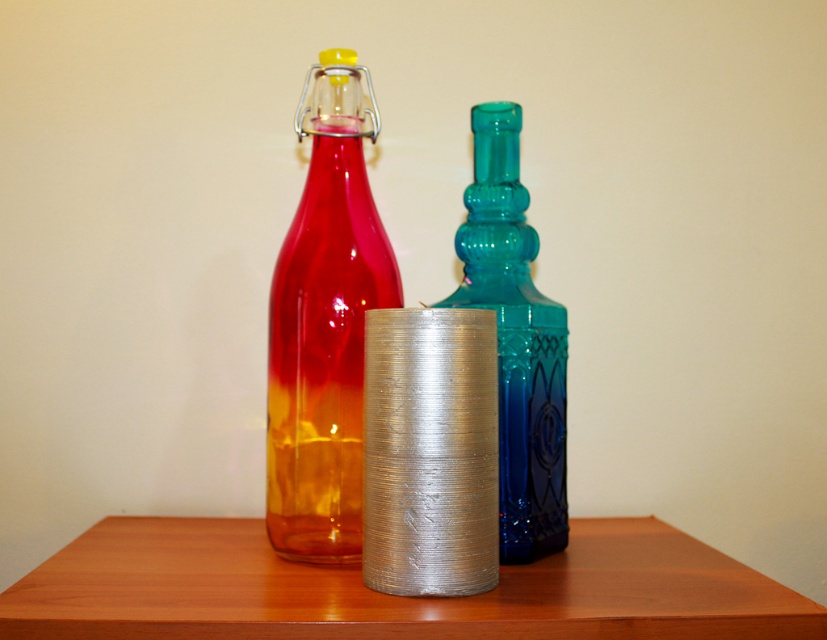
You are a delivery person who needs to place a package that is 6 inches long on the wooden table at center without touching the translucent blue glass bottle at center. Is there enough space?

The wooden table at center and translucent blue glass bottle at center are 5.82 inches apart from each other. Since the package is 6 inches long, placing it between them would require at least 6 inches of space, but there is only 5.82 inches available. Therefore, there isn not enough space to place the package without touching the bottle.

You are a photographer setting up a shot of the three glass objects. You want to focus on the object closest to the camera. Which object is at point (313, 512)?

The point (313, 512) is 73.34 centimeters from the camera, so the object at that point is not the closest one.

You are arranging items on the wooden table at center and the translucent amber glass bottle at center. According to the scene, which object is positioned to the left of the other?

The translucent amber glass bottle at center is to the left of the wooden table at center because the wooden table at center is to the right of the translucent amber glass bottle at center.